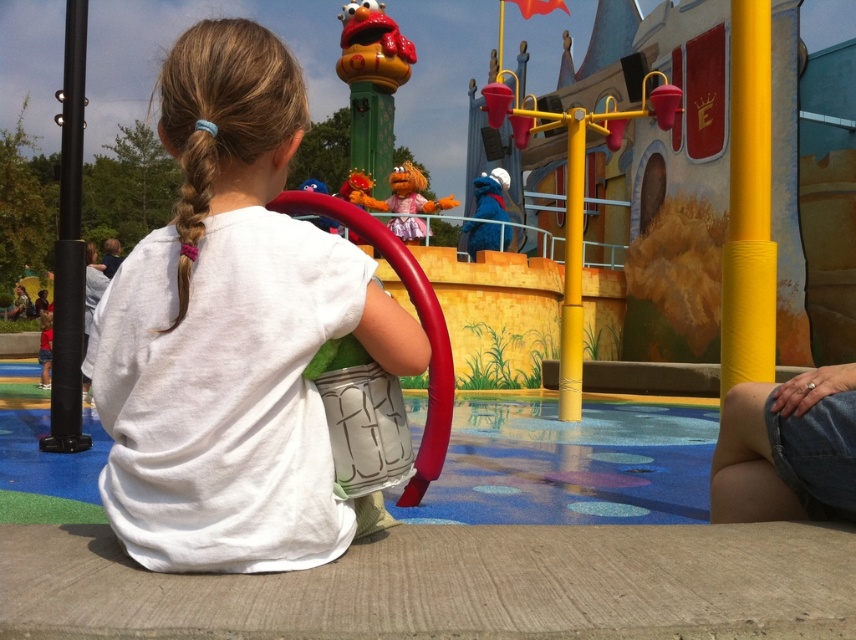
You are a parent trying to find your child who is playing in the area. You see the denim shorts at lower right and the rubberized red ring at upper center. Which object is closer to you?

The denim shorts at lower right is closer to you since it is only 5.40 feet away from the rubberized red ring at upper center, meaning the denim shorts is nearer than the red ring.

You are a photographer setting up for a group photo. You notice the blonde hair at upper left and the blue plush toy at upper center in your frame. Which object should you adjust your camera angle to focus on if you want to capture the wider subject?

The blonde hair at upper left is wider than the blue plush toy at upper center, so you should focus on the blonde hair at upper left to capture the wider subject.

You are a parent trying to locate your child who has wandered off. You see the blonde hair at upper left and the blue plush toy at upper center. Which object is closer to you?

The blonde hair at upper left is closer to you because it is in front of the blue plush toy at upper center.